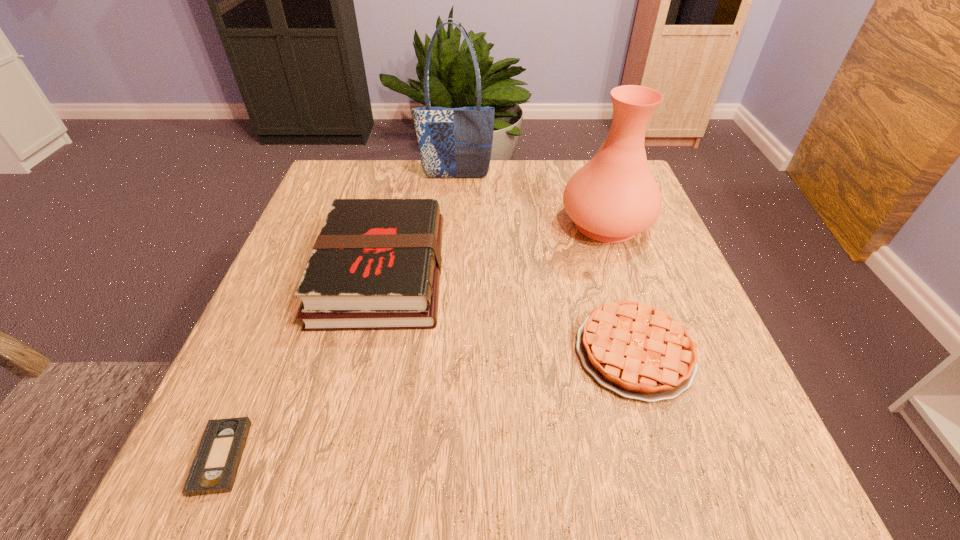
Locate an element on the screen. The height and width of the screenshot is (540, 960). empty location between the third shortest object and the second shortest object is located at coordinates (508, 312).

Where is `free spot between the fourth shortest object and the nearest object`? Image resolution: width=960 pixels, height=540 pixels. free spot between the fourth shortest object and the nearest object is located at coordinates (414, 340).

Locate an element on the screen. The width and height of the screenshot is (960, 540). free space that is in between the pie and the vase is located at coordinates (620, 287).

Choose which object is the fourth nearest neighbor to the vase. Please provide its 2D coordinates. Your answer should be formatted as a tuple, i.e. [(x, y)], where the tuple contains the x and y coordinates of a point satisfying the conditions above.

[(215, 466)]

Find the location of a particular element. The width and height of the screenshot is (960, 540). object that is the nearest to the leftmost object is located at coordinates (376, 264).

Identify the location of vacant position in the image that satisfies the following two spatial constraints: 1. on the front-facing side of the pie; 2. on the right side of the shopping bag. (444, 352).

Locate an element on the screen. free spot that satisfies the following two spatial constraints: 1. on the front-facing side of the farthest object; 2. on the left side of the pie is located at coordinates (444, 352).

Find the location of `vacant space that satisfies the following two spatial constraints: 1. on the front-facing side of the pie; 2. on the right side of the farthest object`. vacant space that satisfies the following two spatial constraints: 1. on the front-facing side of the pie; 2. on the right side of the farthest object is located at coordinates (444, 352).

Where is `vacant space that satisfies the following two spatial constraints: 1. on the front-facing side of the tallest object; 2. on the left side of the vase`? vacant space that satisfies the following two spatial constraints: 1. on the front-facing side of the tallest object; 2. on the left side of the vase is located at coordinates tap(453, 222).

Identify the location of free space that satisfies the following two spatial constraints: 1. on the front-facing side of the vase; 2. on the right side of the farthest object. (453, 222).